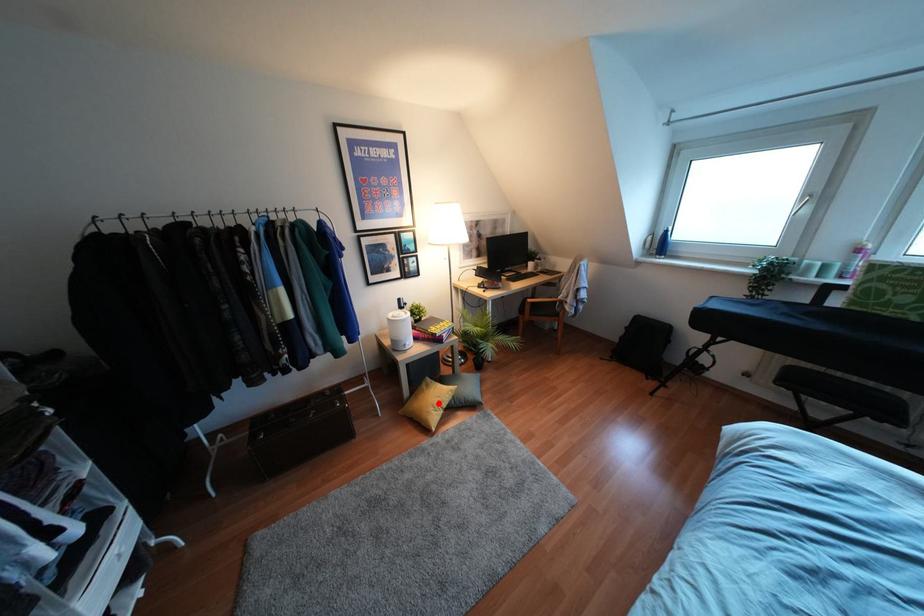
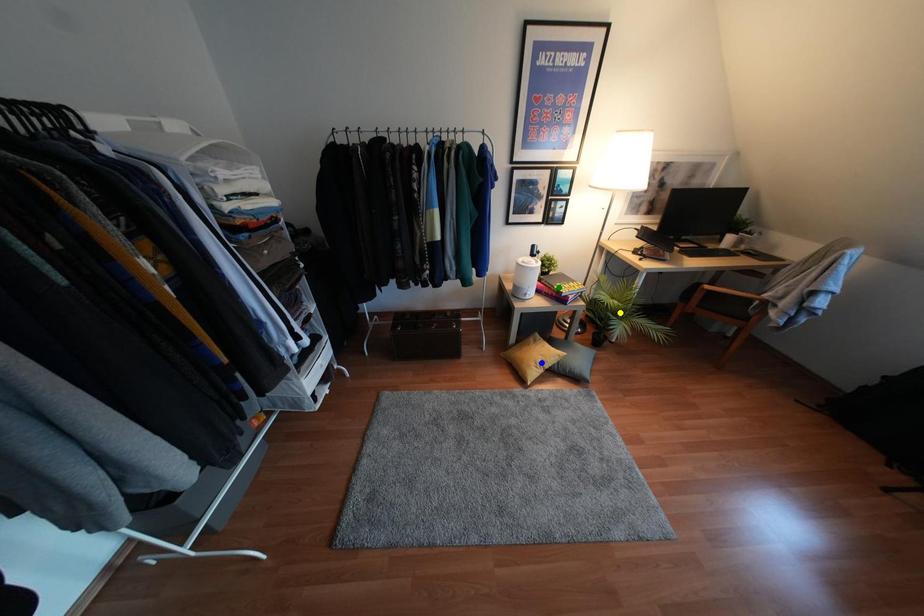
Question: I am providing you with two images of the same scene from different viewpoints. A red point is marked on the first image. You are given multiple points on the second image. Which mark in image 2 goes with the point in image 1?

Choices:
 (A) green point
 (B) blue point
 (C) yellow point

Answer: (B)